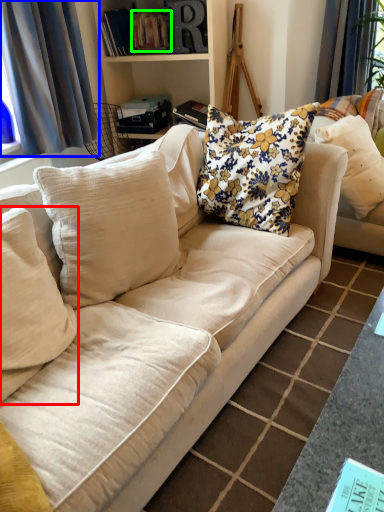
Question: Which object is the closest to the pillow (highlighted by a red box)? Choose among these: curtain (highlighted by a blue box) or book (highlighted by a green box).

Choices:
 (A) curtain
 (B) book

Answer: (A)